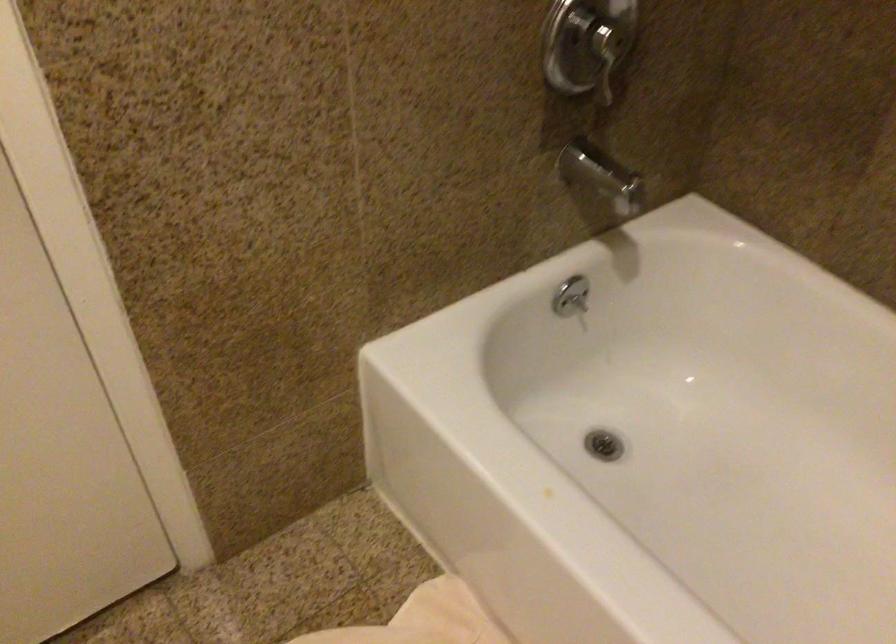
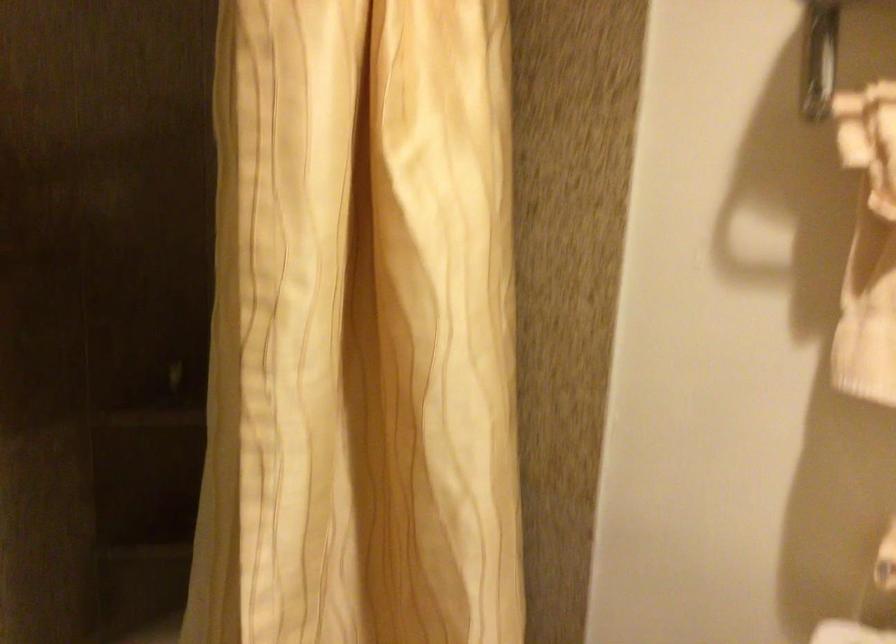
First-person continuous shooting, in which direction is the camera rotating?

The rotation direction of the camera is right-down.